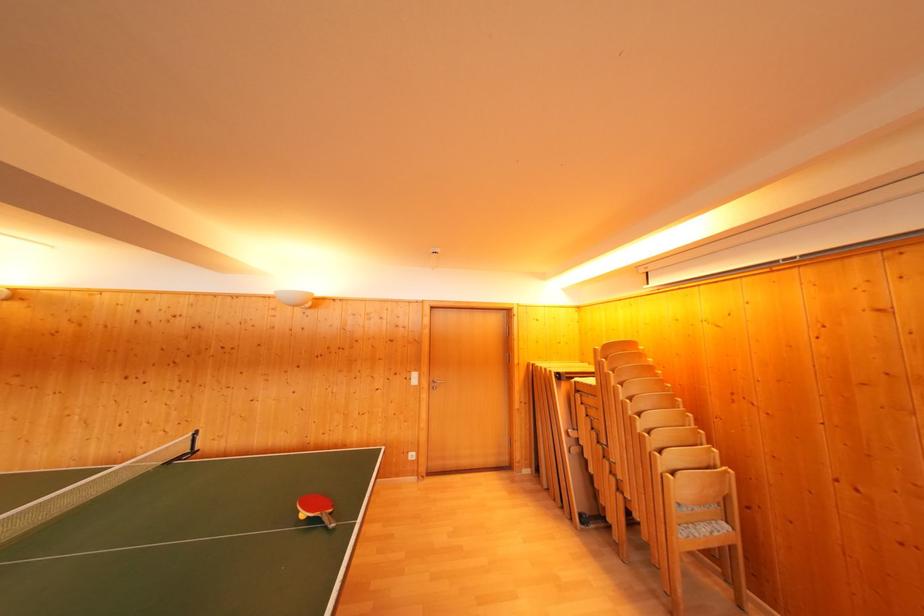
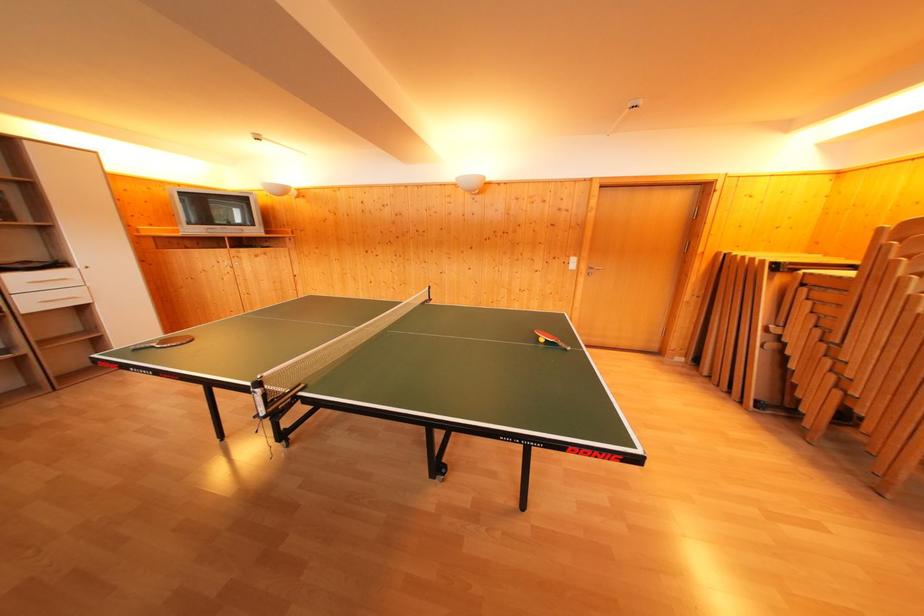
In the second image, find the point that corresponds to pixel 330 524 in the first image.

(565, 350)